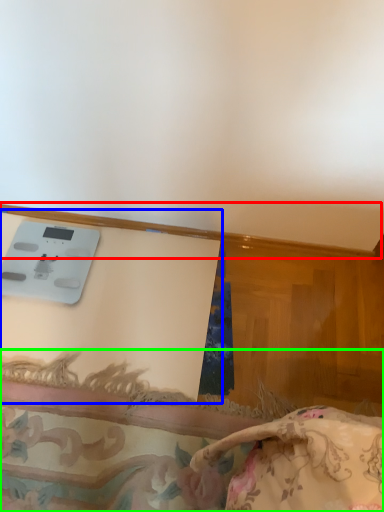
Question: Considering the real-world distances, which object is farthest from trim (highlighted by a red box)? table (highlighted by a blue box) or furniture (highlighted by a green box)?

Choices:
 (A) table
 (B) furniture

Answer: (B)